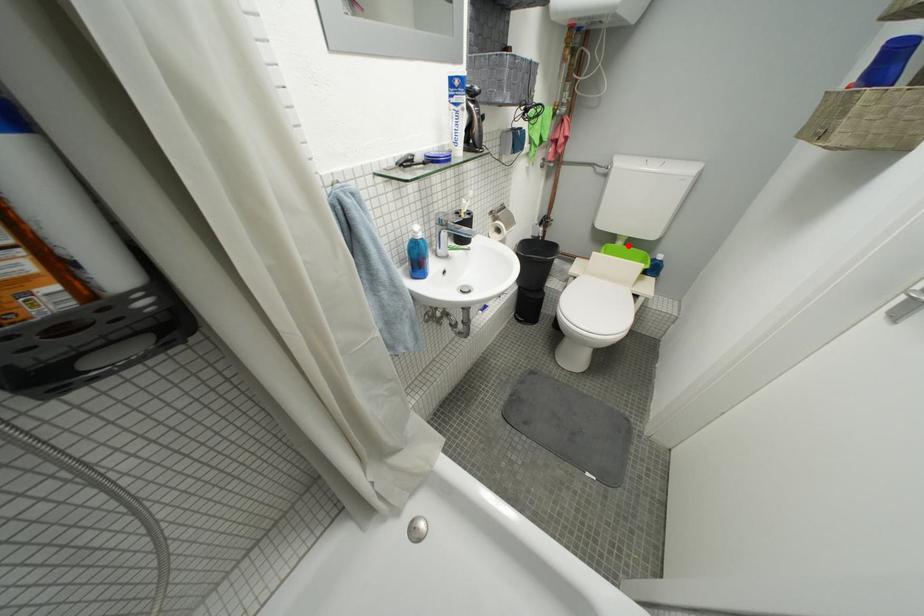
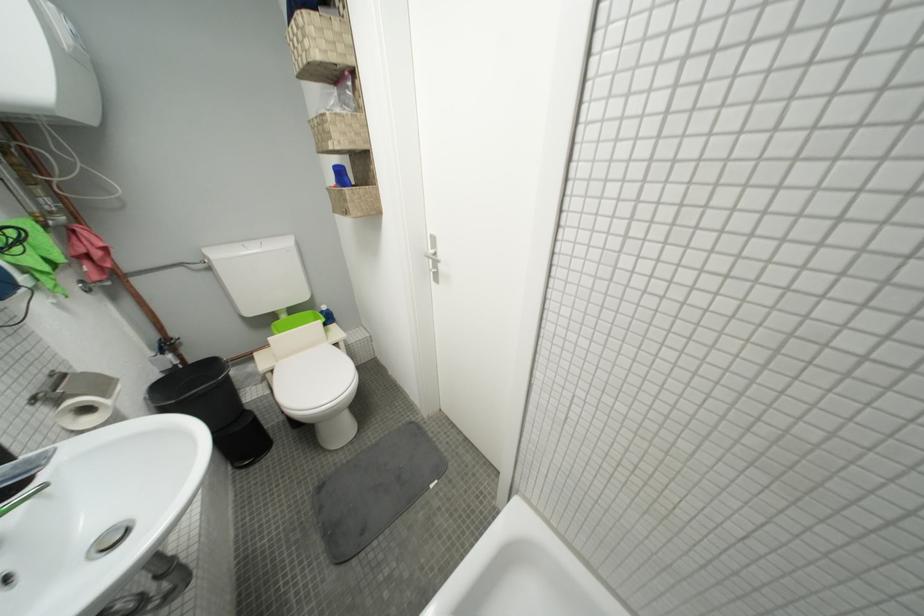
Question: I am providing you with two images of the same scene from different viewpoints. In image1, a red point is highlighted. Considering the same 3D point in image2, which of the following is correct?

Choices:
 (A) It is closer
 (B) It is farther

Answer: (A)